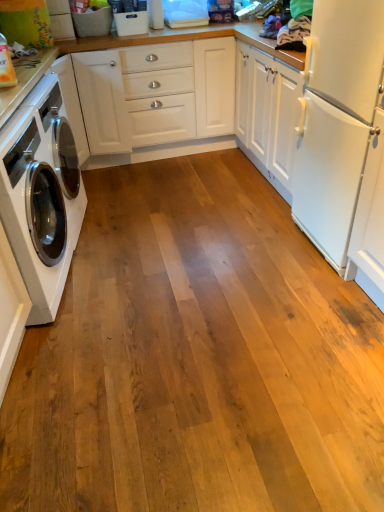
The image size is (384, 512). Describe the element at coordinates (41, 195) in the screenshot. I see `white glossy washing machine at left` at that location.

Where is `white glossy washing machine at left`? white glossy washing machine at left is located at coordinates (41, 195).

You are a GUI agent. You are given a task and a screenshot of the screen. Output one action in this format:
    pyautogui.click(x=<x>, y=<y>)
    Task: Click on the white glossy washing machine at left
    This screenshot has height=512, width=384.
    Given the screenshot: What is the action you would take?
    pyautogui.click(x=41, y=195)